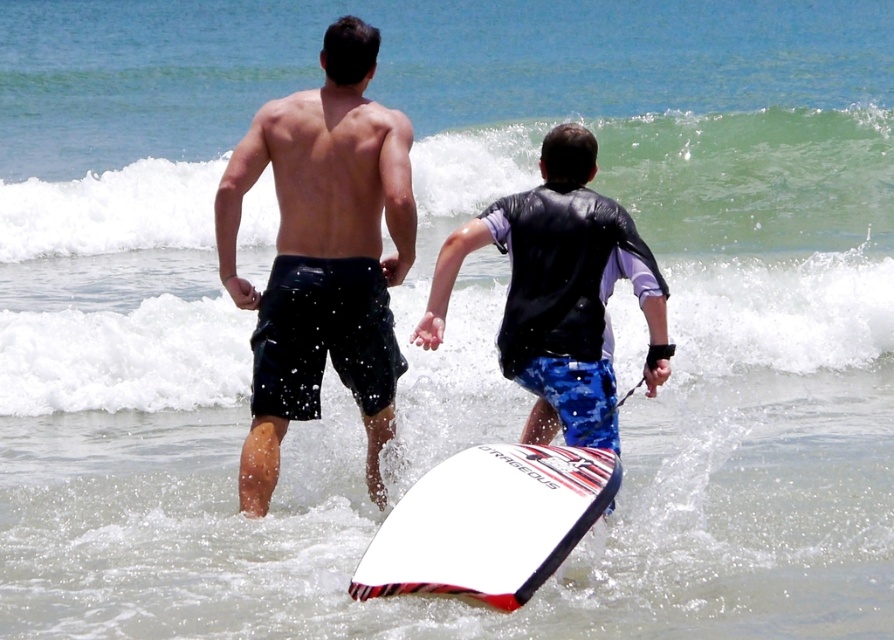
Does point (218, 204) come in front of point (477, 474)?

No, it is not.

What do you see at coordinates (322, 253) in the screenshot? I see `black matte shorts at center` at bounding box center [322, 253].

Between point (242, 484) and point (509, 458), which one is positioned behind?

The point (242, 484) is behind.

Locate an element on the screen. This screenshot has height=640, width=894. black matte shorts at center is located at coordinates (322, 253).

Can you confirm if blue camouflage shorts at center is smaller than white matte surfboard at center?

Incorrect, blue camouflage shorts at center is not smaller in size than white matte surfboard at center.

Is blue camouflage shorts at center further to the viewer compared to white matte surfboard at center?

Yes, blue camouflage shorts at center is behind white matte surfboard at center.

You are a GUI agent. You are given a task and a screenshot of the screen. Output one action in this format:
    pyautogui.click(x=<x>, y=<y>)
    Task: Click on the blue camouflage shorts at center
    Image resolution: width=894 pixels, height=640 pixels.
    Given the screenshot: What is the action you would take?
    pyautogui.click(x=561, y=292)

Can you confirm if green frothy wave at upper center is positioned above blue camouflage shorts at center?

Correct, green frothy wave at upper center is located above blue camouflage shorts at center.

Can you confirm if green frothy wave at upper center is shorter than blue camouflage shorts at center?

Incorrect, green frothy wave at upper center's height does not fall short of blue camouflage shorts at center's.

Image resolution: width=894 pixels, height=640 pixels. Find the location of `green frothy wave at upper center`. green frothy wave at upper center is located at coordinates click(x=752, y=179).